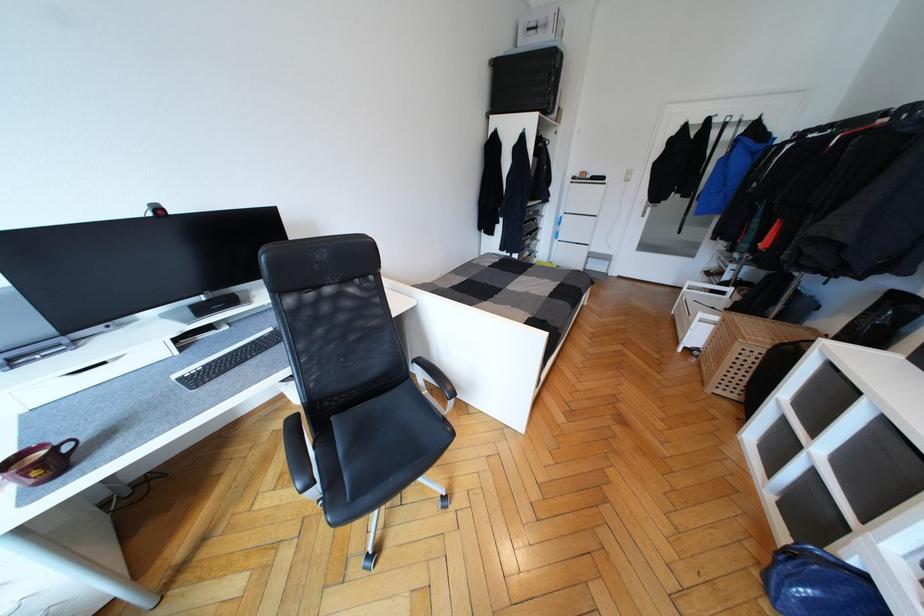
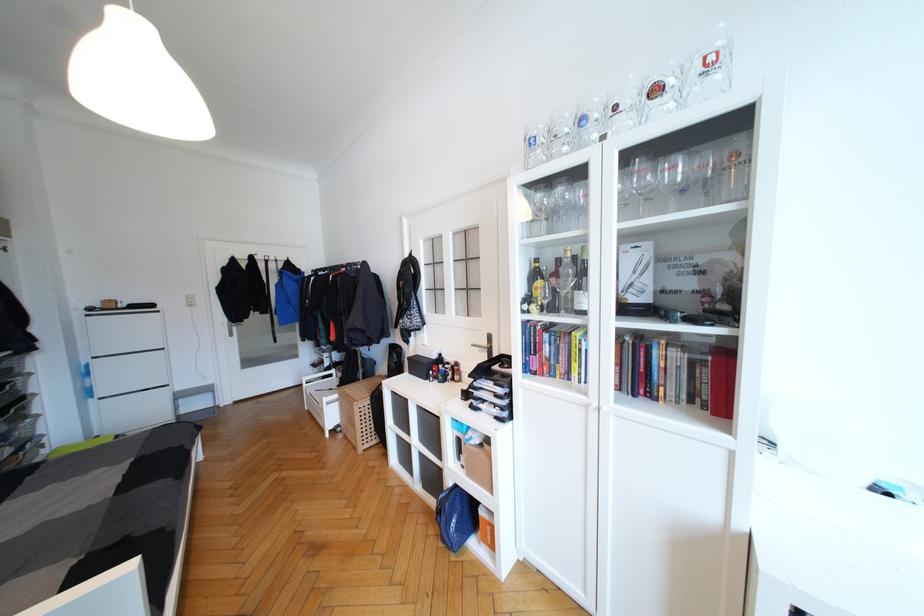
Where in the second image is the point corresponding to (x=817, y=475) from the first image?

(423, 456)